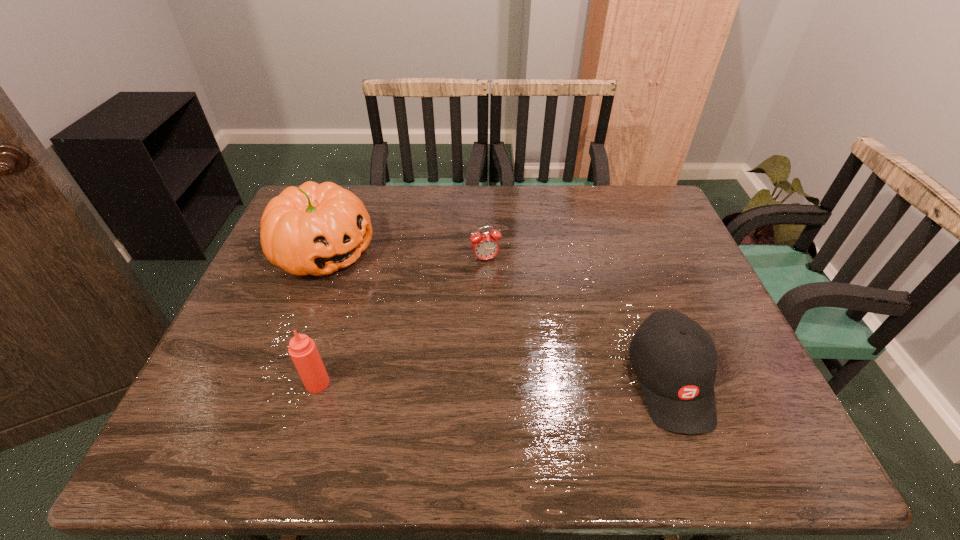
Find the location of a particular element. The width and height of the screenshot is (960, 540). vacant space on the desktop that is between the Tabasco sauce and the rightmost object and is positioned on the carved face of the pumpkin is located at coordinates (540, 382).

Where is `vacant space on the desktop that is between the Tabasco sauce and the rightmost object and is positioned on the face of the third object from left to right`? This screenshot has height=540, width=960. vacant space on the desktop that is between the Tabasco sauce and the rightmost object and is positioned on the face of the third object from left to right is located at coordinates (529, 382).